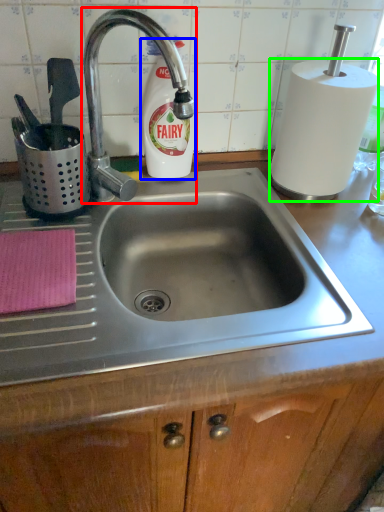
Question: Which object is the closest to the tap (highlighted by a red box)? Choose among these: cleaning product (highlighted by a blue box) or paper towel (highlighted by a green box).

Choices:
 (A) cleaning product
 (B) paper towel

Answer: (A)